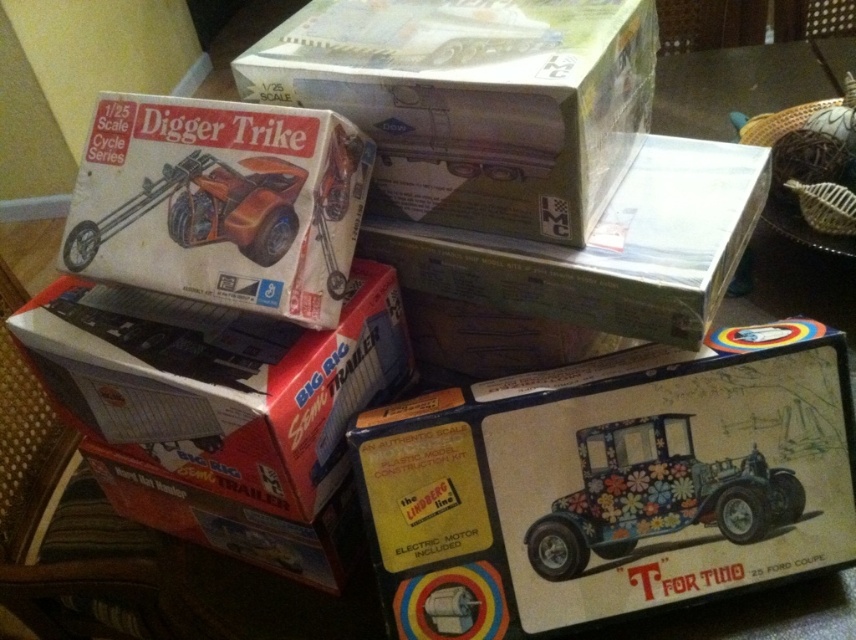
Question: Does matte cardboard box at upper center lie in front of white cardboard box at center?

Choices:
 (A) no
 (B) yes

Answer: (B)

Question: Is orange matte trike at upper left positioned before floral fabric car at lower right?

Choices:
 (A) no
 (B) yes

Answer: (B)

Question: Which of the following is the closest to the observer?

Choices:
 (A) matte cardboard box at upper center
 (B) floral-patterned plastic model kit at center
 (C) metallic orange trike at upper left
 (D) matte green plastic box at upper center

Answer: (A)

Question: Which object is the farthest from the floral fabric car at lower right?

Choices:
 (A) floral-patterned plastic toy car at lower right
 (B) metallic orange trike at upper left
 (C) white cardboard box at center
 (D) floral-patterned plastic model kit at center

Answer: (B)

Question: Can you confirm if floral-patterned plastic model kit at center is smaller than white cardboard box at center?

Choices:
 (A) no
 (B) yes

Answer: (B)

Question: Which object appears farthest from the camera in this image?

Choices:
 (A) white cardboard box at center
 (B) floral-patterned plastic toy car at lower right
 (C) floral-patterned plastic model kit at center

Answer: (B)